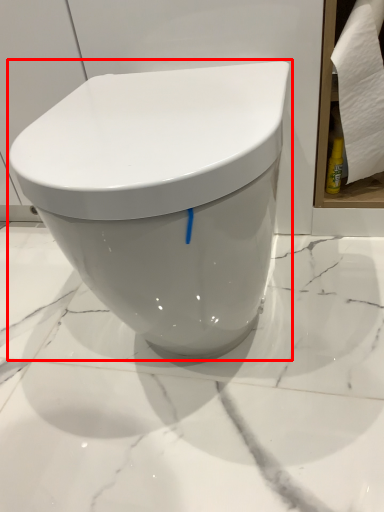
Question: In this image, where is toilet (annotated by the red box) located relative to toilet paper?

Choices:
 (A) right
 (B) left

Answer: (B)